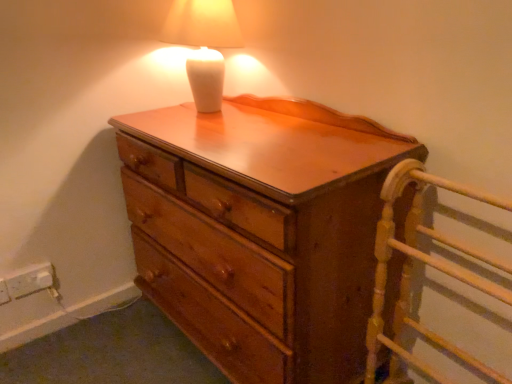
Question: From a real-world perspective, is wooden chest of drawers at center on wooden bed frame at right?

Choices:
 (A) yes
 (B) no

Answer: (A)

Question: Is wooden chest of drawers at center positioned behind wooden bed frame at right?

Choices:
 (A) no
 (B) yes

Answer: (B)

Question: From the image's perspective, is wooden chest of drawers at center located beneath wooden bed frame at right?

Choices:
 (A) yes
 (B) no

Answer: (B)

Question: Does wooden chest of drawers at center appear on the left side of wooden bed frame at right?

Choices:
 (A) no
 (B) yes

Answer: (B)

Question: Does wooden chest of drawers at center turn towards wooden bed frame at right?

Choices:
 (A) no
 (B) yes

Answer: (A)

Question: From a real-world perspective, relative to white plastic electric outlet at lower left, is white glossy lamp at upper center vertically above or below?

Choices:
 (A) below
 (B) above

Answer: (B)

Question: Looking at the image, does white glossy lamp at upper center seem bigger or smaller compared to white plastic electric outlet at lower left?

Choices:
 (A) small
 (B) big

Answer: (B)

Question: Is white glossy lamp at upper center wider or thinner than white plastic electric outlet at lower left?

Choices:
 (A) wide
 (B) thin

Answer: (A)

Question: From the image's perspective, relative to white plastic electric outlet at lower left, is white glossy lamp at upper center above or below?

Choices:
 (A) above
 (B) below

Answer: (A)

Question: Considering the relative positions of wooden chest of drawers at center and wooden bed frame at right in the image provided, is wooden chest of drawers at center to the left or to the right of wooden bed frame at right?

Choices:
 (A) right
 (B) left

Answer: (B)

Question: From the image's perspective, is wooden chest of drawers at center positioned above or below wooden bed frame at right?

Choices:
 (A) above
 (B) below

Answer: (A)

Question: From a real-world perspective, is wooden chest of drawers at center positioned above or below wooden bed frame at right?

Choices:
 (A) below
 (B) above

Answer: (B)

Question: In terms of width, does wooden chest of drawers at center look wider or thinner when compared to wooden bed frame at right?

Choices:
 (A) wide
 (B) thin

Answer: (A)

Question: Is wooden chest of drawers at center to the left or to the right of white glossy lamp at upper center in the image?

Choices:
 (A) left
 (B) right

Answer: (B)

Question: Considering the positions of wooden chest of drawers at center and white glossy lamp at upper center in the image, is wooden chest of drawers at center taller or shorter than white glossy lamp at upper center?

Choices:
 (A) tall
 (B) short

Answer: (A)